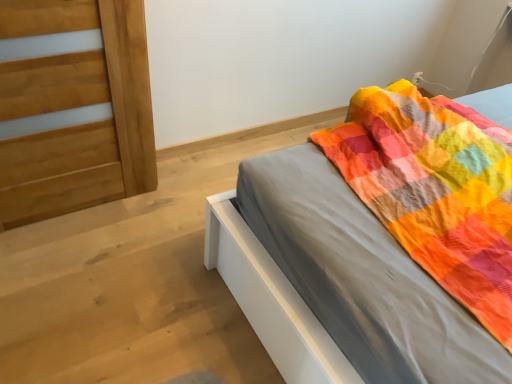
Question: From the image's perspective, is matte gray bed at center positioned above or below light brown wood door at left?

Choices:
 (A) below
 (B) above

Answer: (A)

Question: Relative to light brown wood door at left, is matte gray bed at center in front or behind?

Choices:
 (A) behind
 (B) front

Answer: (B)

Question: Considering the positions of point (264, 236) and point (142, 89), is point (264, 236) closer or farther from the camera than point (142, 89)?

Choices:
 (A) closer
 (B) farther

Answer: (A)

Question: From the image's perspective, relative to matte gray bed at center, is light brown wood door at left above or below?

Choices:
 (A) below
 (B) above

Answer: (B)

Question: Considering the positions of light brown wood door at left and matte gray bed at center in the image, is light brown wood door at left bigger or smaller than matte gray bed at center?

Choices:
 (A) small
 (B) big

Answer: (A)

Question: Is light brown wood door at left spatially inside matte gray bed at center, or outside of it?

Choices:
 (A) inside
 (B) outside

Answer: (B)

Question: Is light brown wood door at left to the left or to the right of matte gray bed at center in the image?

Choices:
 (A) left
 (B) right

Answer: (A)